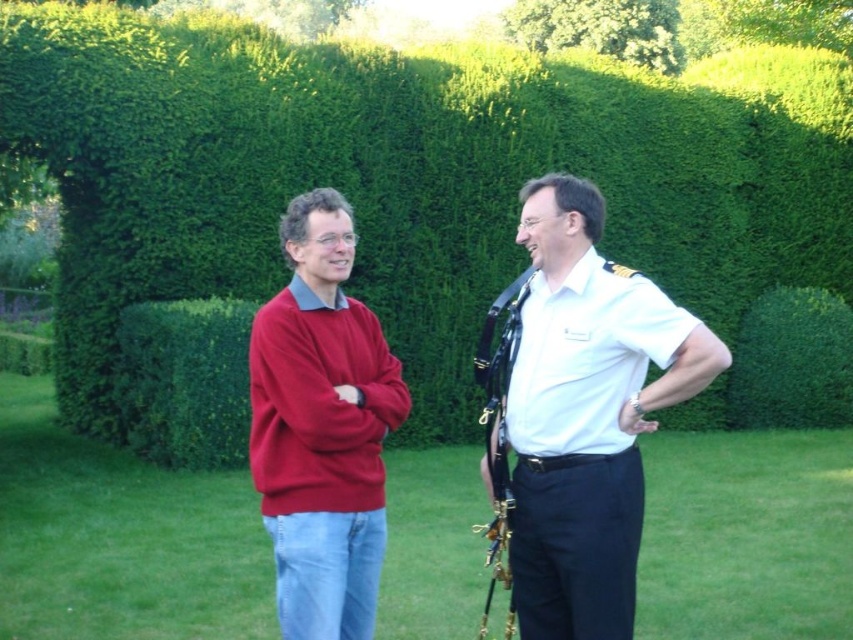
Who is shorter, white smooth polo shirt at right or green leafy bush at upper center?

white smooth polo shirt at right is shorter.

Locate an element on the screen. white smooth polo shirt at right is located at coordinates (587, 356).

Between green leafy hedge at upper center and white smooth polo shirt at right, which one appears on the right side from the viewer's perspective?

From the viewer's perspective, white smooth polo shirt at right appears more on the right side.

Is green leafy hedge at upper center shorter than white smooth polo shirt at right?

In fact, green leafy hedge at upper center may be taller than white smooth polo shirt at right.

Where is `green leafy hedge at upper center`? green leafy hedge at upper center is located at coordinates (407, 177).

Between matte red sweater at center and white smooth polo shirt at right, which one has more height?

Standing taller between the two is matte red sweater at center.

Is matte red sweater at center bigger than white smooth polo shirt at right?

Indeed, matte red sweater at center has a larger size compared to white smooth polo shirt at right.

I want to click on matte red sweater at center, so click(x=321, y=428).